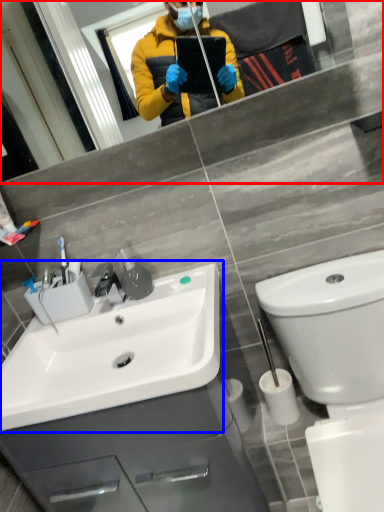
Question: Which of the following is the closest to the observer, mirror (highlighted by a red box) or sink (highlighted by a blue box)?

Choices:
 (A) mirror
 (B) sink

Answer: (A)